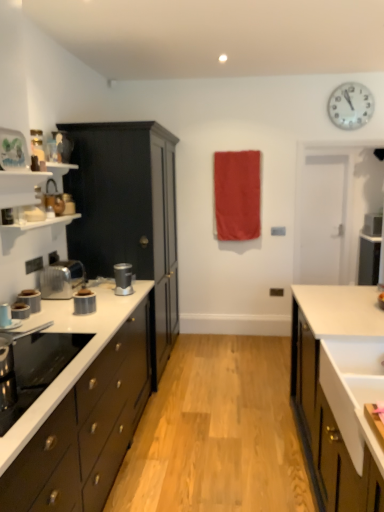
Question: Can you confirm if red fabric at center is taller than satin silver blender at center, the 1th kitchen appliance positioned from the back?

Choices:
 (A) yes
 (B) no

Answer: (A)

Question: Considering the relative sizes of red fabric at center and satin silver blender at center, the 1th kitchen appliance positioned from the back, in the image provided, is red fabric at center shorter than satin silver blender at center, the 1th kitchen appliance positioned from the back,?

Choices:
 (A) yes
 (B) no

Answer: (B)

Question: Does red fabric at center come in front of satin silver blender at center, the 1th kitchen appliance positioned from the back?

Choices:
 (A) no
 (B) yes

Answer: (A)

Question: Does red fabric at center contain satin silver blender at center, arranged as the 6th kitchen appliance when viewed from the front?

Choices:
 (A) yes
 (B) no

Answer: (B)

Question: Considering the relative positions of red fabric at center and satin silver blender at center, the 1th kitchen appliance positioned from the back, in the image provided, is red fabric at center behind satin silver blender at center, the 1th kitchen appliance positioned from the back,?

Choices:
 (A) no
 (B) yes

Answer: (B)

Question: Considering the positions of point (119, 281) and point (352, 351), is point (119, 281) closer or farther from the camera than point (352, 351)?

Choices:
 (A) closer
 (B) farther

Answer: (B)

Question: Based on their sizes in the image, would you say satin silver blender at center, the 1th kitchen appliance positioned from the back, is bigger or smaller than white glossy sink at lower right?

Choices:
 (A) big
 (B) small

Answer: (B)

Question: Considering the positions of satin silver blender at center, arranged as the 6th kitchen appliance when viewed from the front, and white glossy sink at lower right in the image, is satin silver blender at center, arranged as the 6th kitchen appliance when viewed from the front, wider or thinner than white glossy sink at lower right?

Choices:
 (A) thin
 (B) wide

Answer: (A)

Question: In terms of height, does satin silver blender at center, the 1th kitchen appliance positioned from the back, look taller or shorter compared to white glossy sink at lower right?

Choices:
 (A) tall
 (B) short

Answer: (B)

Question: Is white glossy clock at upper right bigger or smaller than white matte sink at right, which ranks as the third cabinetry in left-to-right order?

Choices:
 (A) small
 (B) big

Answer: (A)

Question: Would you say white glossy clock at upper right is to the left or to the right of white matte sink at right, positioned as the first cabinetry in right-to-left order, in the picture?

Choices:
 (A) right
 (B) left

Answer: (A)

Question: Considering the positions of white glossy clock at upper right and white matte sink at right, which ranks as the third cabinetry in left-to-right order, in the image, is white glossy clock at upper right wider or thinner than white matte sink at right, which ranks as the third cabinetry in left-to-right order,?

Choices:
 (A) wide
 (B) thin

Answer: (B)

Question: From the image's perspective, relative to white matte sink at right, positioned as the first cabinetry in right-to-left order, is white glossy clock at upper right above or below?

Choices:
 (A) above
 (B) below

Answer: (A)

Question: In terms of height, does matte black cabinet at left, placed as the 2th cabinetry when sorted from left to right, look taller or shorter compared to white glossy clock at upper right?

Choices:
 (A) short
 (B) tall

Answer: (B)

Question: Based on their positions, is matte black cabinet at left, placed as the 2th cabinetry when sorted from left to right, located to the left or right of white glossy clock at upper right?

Choices:
 (A) right
 (B) left

Answer: (B)